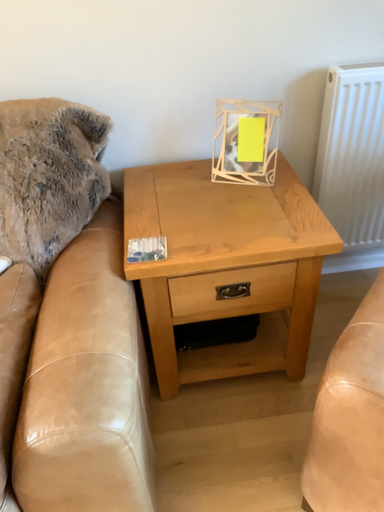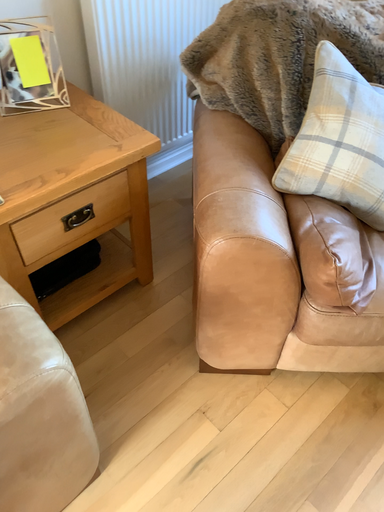
Question: Which way did the camera rotate in the video?

Choices:
 (A) rotated left
 (B) rotated right

Answer: (B)